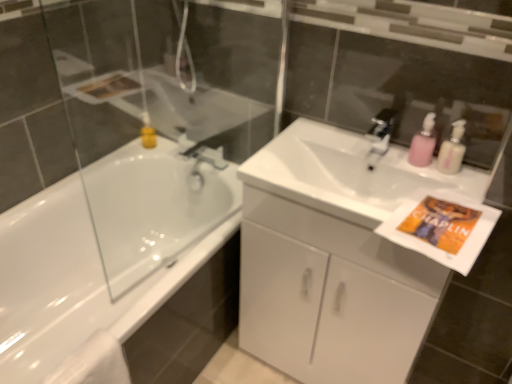
This screenshot has width=512, height=384. Find the location of `vacant area in front of silver metallic faucet at upper center`. vacant area in front of silver metallic faucet at upper center is located at coordinates (401, 168).